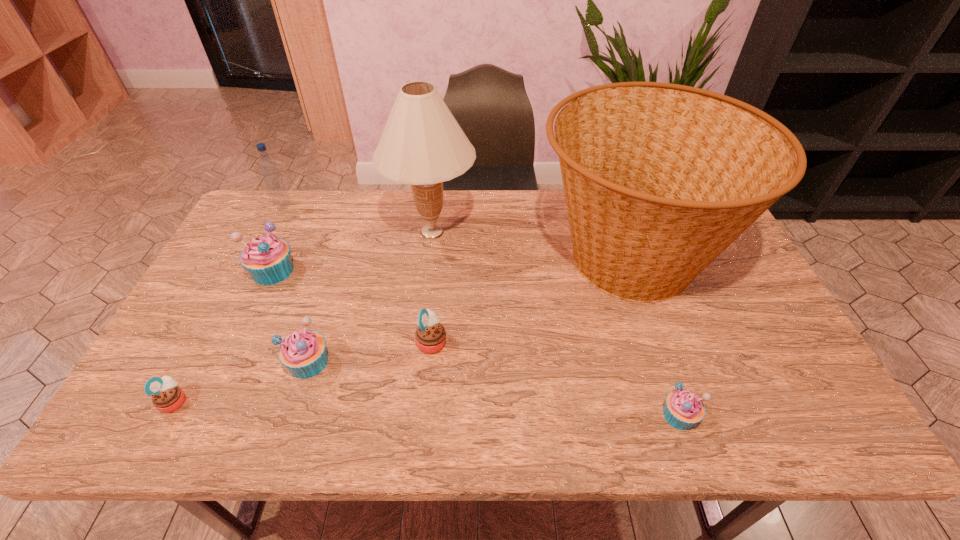
Where is `vacant area that satisfies the following two spatial constraints: 1. on the front side of the lampshade; 2. on the front-facing side of the left pink muffin`? vacant area that satisfies the following two spatial constraints: 1. on the front side of the lampshade; 2. on the front-facing side of the left pink muffin is located at coordinates (412, 401).

At what (x,y) coordinates should I click in order to perform the action: click on free location that satisfies the following two spatial constraints: 1. on the front side of the second blue muffin from left to right; 2. on the left side of the rightmost blue muffin. Please return your answer as a coordinate pair (x, y). This screenshot has width=960, height=540. Looking at the image, I should click on pyautogui.click(x=292, y=415).

The image size is (960, 540). What are the coordinates of `free spot that satisfies the following two spatial constraints: 1. on the front side of the fourth object from left to right; 2. on the right side of the rightmost blue muffin` in the screenshot? It's located at (292, 415).

Image resolution: width=960 pixels, height=540 pixels. Identify the location of vacant space that satisfies the following two spatial constraints: 1. on the front-facing side of the nearest blue muffin; 2. on the right side of the left pink muffin. coord(167,415).

I want to click on vacant area in the image that satisfies the following two spatial constraints: 1. on the front side of the farthest blue muffin; 2. on the right side of the rightmost blue muffin, so click(x=206, y=415).

Find the location of `free space that satisfies the following two spatial constraints: 1. on the front side of the biggest blue muffin; 2. on the front-facing side of the nearer pink muffin`. free space that satisfies the following two spatial constraints: 1. on the front side of the biggest blue muffin; 2. on the front-facing side of the nearer pink muffin is located at coordinates (213, 401).